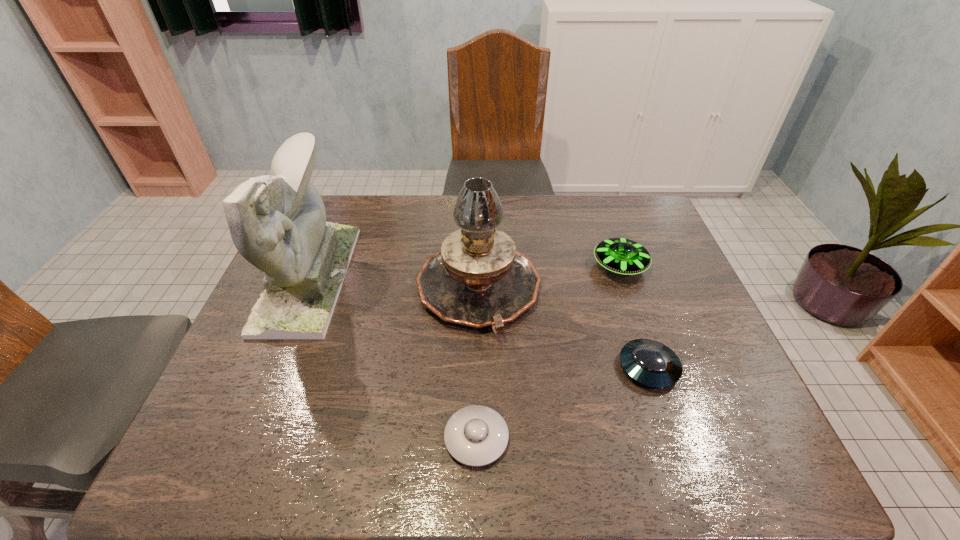
Find the location of a particular element. This screenshot has height=540, width=960. the tallest object is located at coordinates (278, 223).

Image resolution: width=960 pixels, height=540 pixels. I want to click on sculpture, so click(278, 223).

You are a GUI agent. You are given a task and a screenshot of the screen. Output one action in this format:
    pyautogui.click(x=<x>, y=<y>)
    Task: Click on the oil lamp
    
    Given the screenshot: What is the action you would take?
    pyautogui.click(x=478, y=279)

At what (x,y) coordinates should I click in order to perform the action: click on the tallest saucer. Please return your answer as a coordinate pair (x, y). The width and height of the screenshot is (960, 540). Looking at the image, I should click on (623, 256).

Where is `the farthest saucer`? the farthest saucer is located at coordinates (623, 256).

You are a GUI agent. You are given a task and a screenshot of the screen. Output one action in this format:
    pyautogui.click(x=<x>, y=<y>)
    Task: Click on the second farthest saucer
    The width and height of the screenshot is (960, 540).
    Given the screenshot: What is the action you would take?
    pyautogui.click(x=650, y=363)

Find the location of `the nearest object`. the nearest object is located at coordinates (476, 435).

The image size is (960, 540). Identify the location of the nearest saucer. [476, 435].

The width and height of the screenshot is (960, 540). What are the coordinates of `vacant space located on the base of the sculpture` in the screenshot? It's located at (387, 278).

The image size is (960, 540). Find the location of `free location located 0.250m on the front of the oil lamp`. free location located 0.250m on the front of the oil lamp is located at coordinates [x=478, y=443].